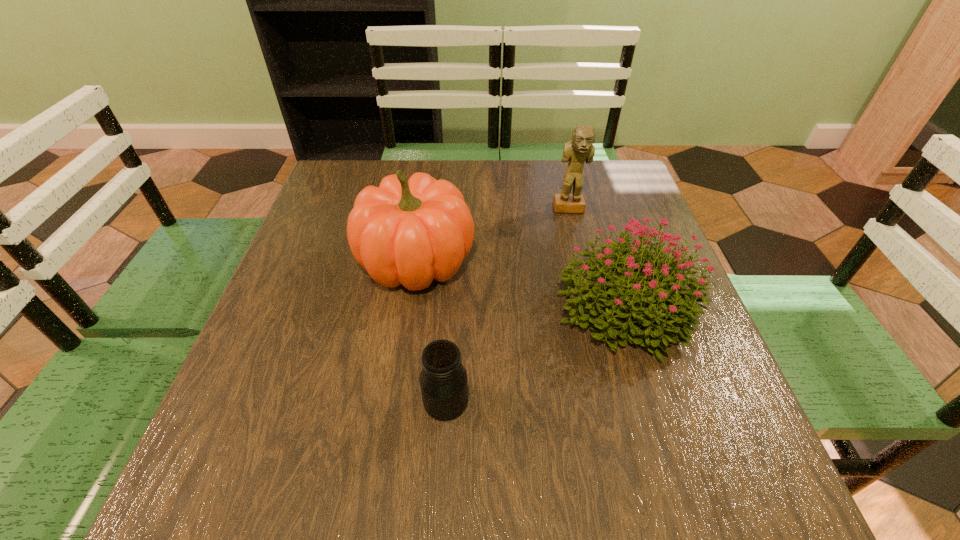
Locate an element on the screen. The image size is (960, 540). pumpkin is located at coordinates 404,232.

Where is `the farthest object`? This screenshot has width=960, height=540. the farthest object is located at coordinates (580, 149).

Where is `bouquet`? bouquet is located at coordinates (650, 313).

Find the location of `the shortest object`. the shortest object is located at coordinates (443, 381).

This screenshot has height=540, width=960. I want to click on jar, so click(443, 381).

The width and height of the screenshot is (960, 540). In order to click on blank area located on the front of the pumpkin in this screenshot , I will do `click(384, 487)`.

The height and width of the screenshot is (540, 960). What are the coordinates of `vacant space located on the front-facing side of the farthest object` in the screenshot? It's located at (579, 250).

The image size is (960, 540). Find the location of `vacant space situated 0.220m on the back of the bouquet`. vacant space situated 0.220m on the back of the bouquet is located at coordinates (592, 203).

Where is `free space located on the back of the jar`? This screenshot has width=960, height=540. free space located on the back of the jar is located at coordinates (451, 316).

Where is `object situated at the far edge`? The height and width of the screenshot is (540, 960). object situated at the far edge is located at coordinates (580, 149).